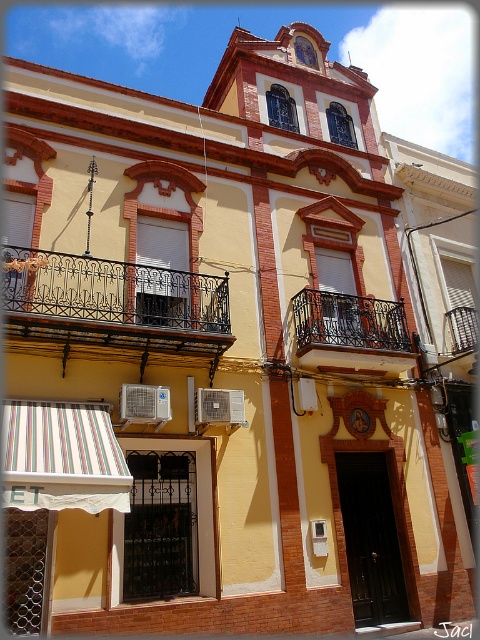
Question: Which of the following is the farthest from the observer?

Choices:
 (A) (144, 330)
 (B) (320, 358)

Answer: (B)

Question: Among these points, which one is farthest from the camera?

Choices:
 (A) (193, 284)
 (B) (382, 364)

Answer: (B)

Question: Which of the following is the farthest from the observer?

Choices:
 (A) black wrought iron balcony at upper left
 (B) black wrought iron balcony at center

Answer: (B)

Question: Is black wrought iron balcony at upper left to the left of black wrought iron balcony at center from the viewer's perspective?

Choices:
 (A) no
 (B) yes

Answer: (B)

Question: Is black wrought iron balcony at upper left bigger than black wrought iron balcony at center?

Choices:
 (A) yes
 (B) no

Answer: (A)

Question: Does black wrought iron balcony at upper left appear on the left side of black wrought iron balcony at center?

Choices:
 (A) no
 (B) yes

Answer: (B)